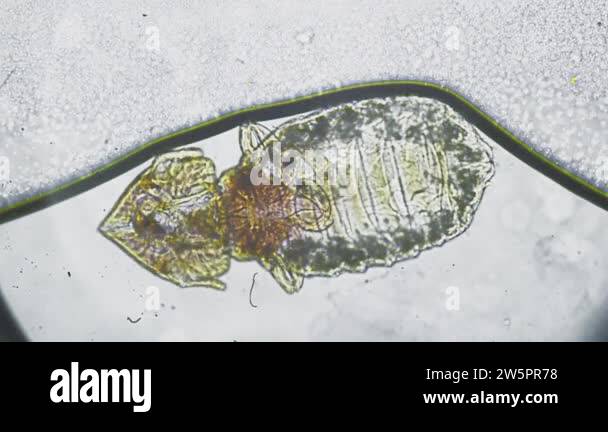
In order to click on white countertop in this screenshot , I will do `click(278, 318)`.